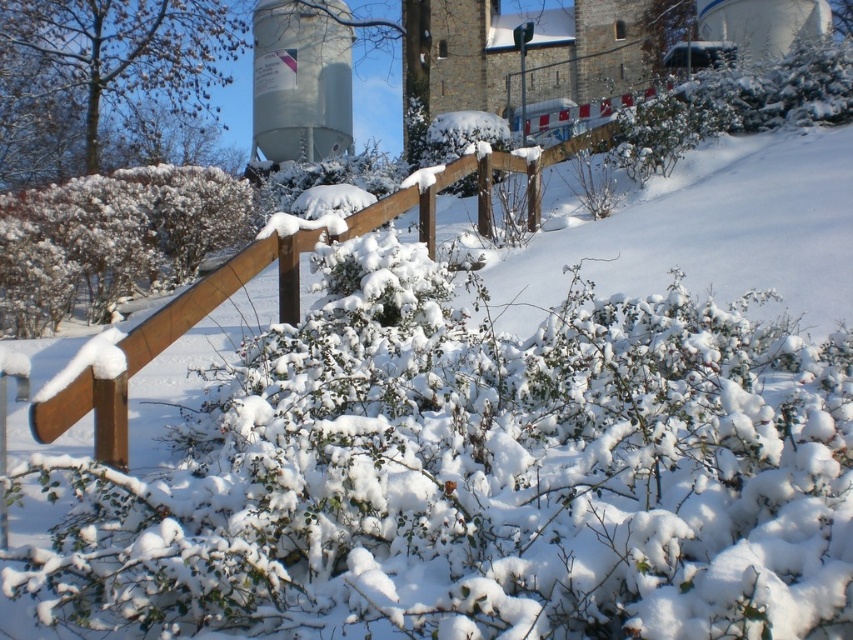
In the scene shown: Is white fluffy bush at left in front of metallic gray water tower at upper center?

Yes, white fluffy bush at left is closer to the viewer.

Which is more to the left, white fluffy bush at left or metallic gray water tower at upper center?

white fluffy bush at left

You are a GUI agent. You are given a task and a screenshot of the screen. Output one action in this format:
    pyautogui.click(x=<x>, y=<y>)
    Task: Click on the white fluffy bush at left
    This screenshot has width=853, height=640.
    Given the screenshot: What is the action you would take?
    pyautogui.click(x=112, y=237)

This screenshot has height=640, width=853. Find the location of `white fluffy bush at left`. white fluffy bush at left is located at coordinates (112, 237).